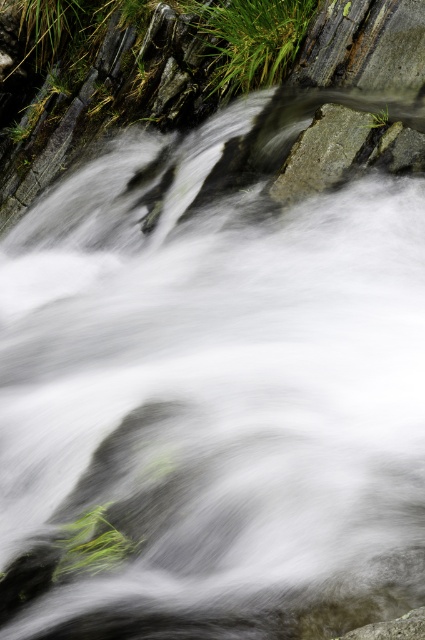
Can you confirm if green grass at upper center is positioned above gray rough rock at center?

Correct, green grass at upper center is located above gray rough rock at center.

Is green grass at upper center shorter than gray rough rock at center?

Incorrect, green grass at upper center's height does not fall short of gray rough rock at center's.

Does point (240, 17) come behind point (314, 179)?

Yes, point (240, 17) is behind point (314, 179).

You are a GUI agent. You are given a task and a screenshot of the screen. Output one action in this format:
    pyautogui.click(x=<x>, y=<y>)
    Task: Click on the green grass at upper center
    This screenshot has height=640, width=425.
    Given the screenshot: What is the action you would take?
    pyautogui.click(x=249, y=38)